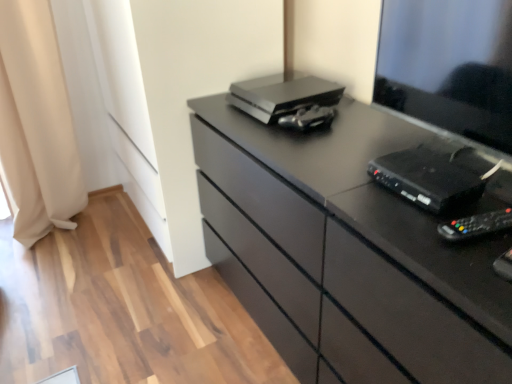
The image size is (512, 384). I want to click on free space on the front side of metallic silver game controller at center, which is the 3th equipment in front-to-back order, so click(x=322, y=147).